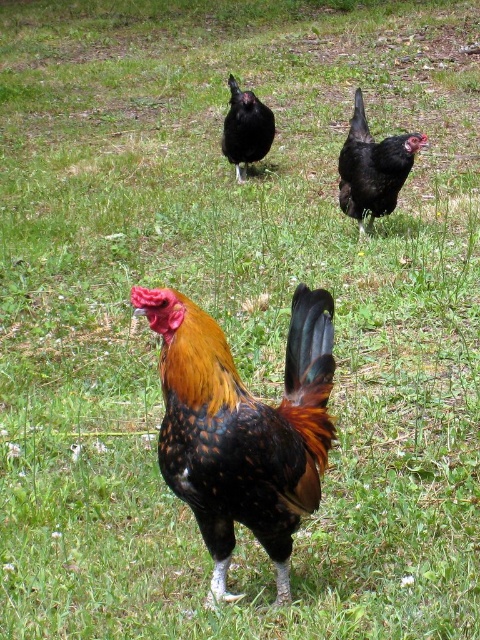
Question: Which of the following is the farthest from the observer?

Choices:
 (A) (342, 200)
 (B) (255, 132)

Answer: (B)

Question: Can you confirm if black glossy chicken at upper right is bigger than black glossy chicken at center?

Choices:
 (A) yes
 (B) no

Answer: (B)

Question: Which object is farther from the camera taking this photo?

Choices:
 (A) black glossy chicken at center
 (B) multicolored feathered rooster at center

Answer: (A)

Question: Is multicolored feathered rooster at center bigger than black glossy chicken at center?

Choices:
 (A) yes
 (B) no

Answer: (B)

Question: Considering the real-world distances, which object is farthest from the black glossy chicken at upper right?

Choices:
 (A) multicolored feathered rooster at center
 (B) black glossy chicken at center

Answer: (A)

Question: Can you confirm if multicolored feathered rooster at center is positioned below black glossy chicken at upper right?

Choices:
 (A) yes
 (B) no

Answer: (A)